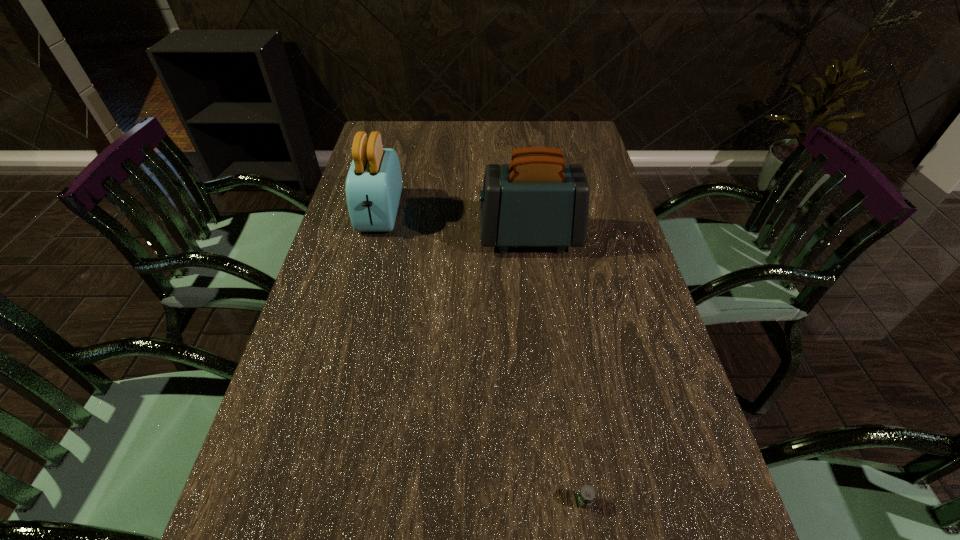
In order to click on object positioned at the right edge in this screenshot , I will do `click(537, 200)`.

In the image, there is a desktop. Where is `free space at the far edge`? free space at the far edge is located at coordinates (503, 130).

I want to click on free spot at the left edge of the desktop, so click(321, 323).

In the image, there is a desktop. Where is `free region at the right edge`? Image resolution: width=960 pixels, height=540 pixels. free region at the right edge is located at coordinates (599, 208).

Where is `vacant space at the far left corner of the desktop`? The image size is (960, 540). vacant space at the far left corner of the desktop is located at coordinates (396, 129).

Image resolution: width=960 pixels, height=540 pixels. Find the location of `vacant region at the far right corner of the desktop`. vacant region at the far right corner of the desktop is located at coordinates (586, 153).

In order to click on vacant region between the left toaster and the right toaster in this screenshot , I will do `click(455, 225)`.

Locate an element on the screen. The height and width of the screenshot is (540, 960). unoccupied area between the left toaster and the beer can is located at coordinates pos(482,357).

The width and height of the screenshot is (960, 540). I want to click on empty location between the shortest object and the right toaster, so click(557, 369).

Identify the location of free area in between the leftmost object and the right toaster. (455, 225).